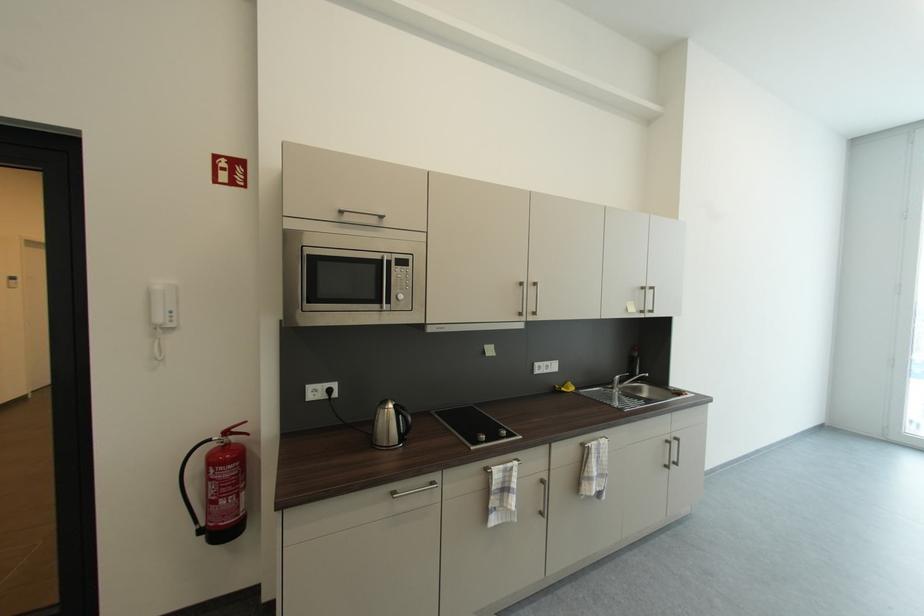
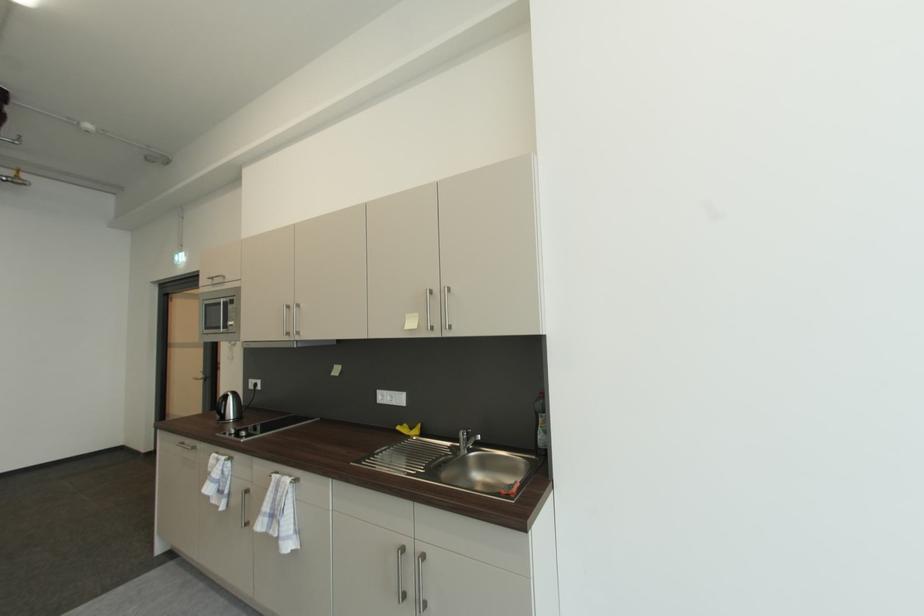
Find the pixel in the second image that matches (500,488) in the first image.

(215, 471)